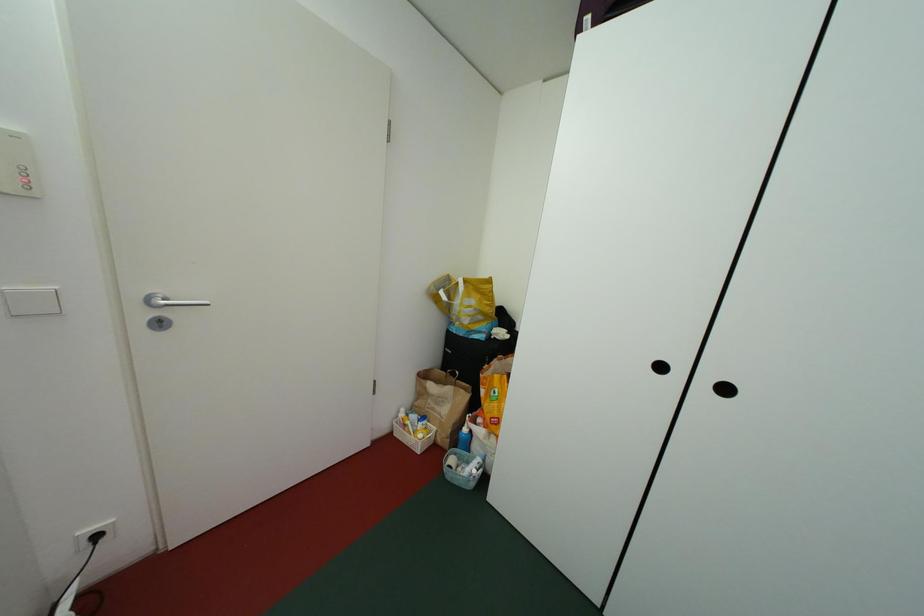
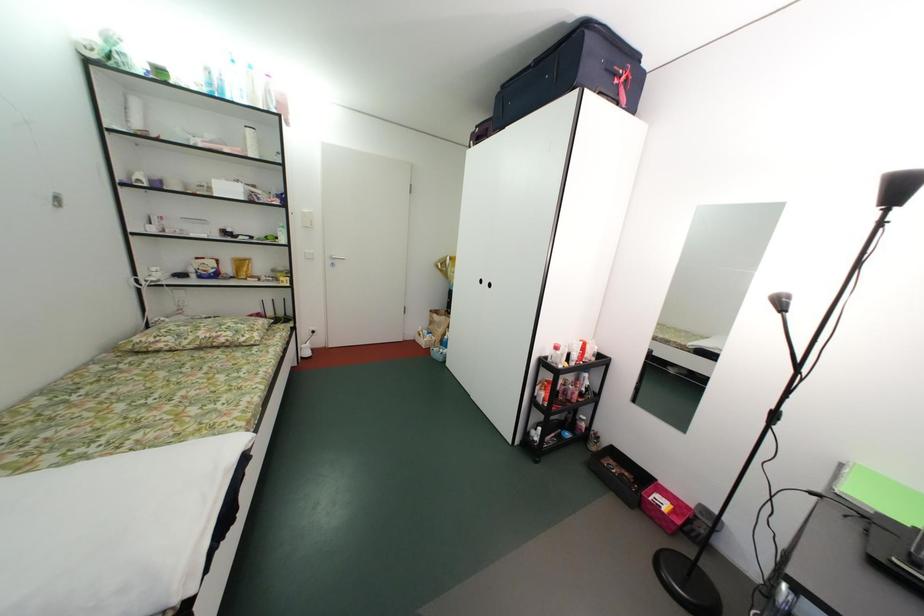
The images are taken continuously from a first-person perspective. In which direction are you moving?

The cameraman moved toward right, backward.